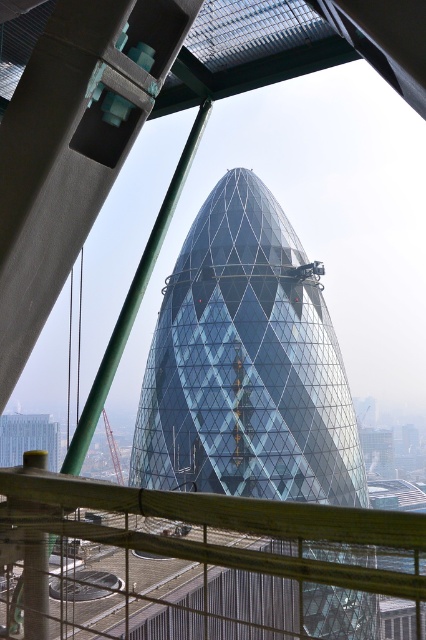
You are standing in a room with a view of the Gherkin building. There is a wooden rail at center. If you look through the gap between the wooden rail at center and the glass panels of the Gherkin building, where would the point at coordinates point (198, 564) be located?

The point at coordinates point (198, 564) corresponds to the wooden rail at center, so it would be located at the wooden rail at center.